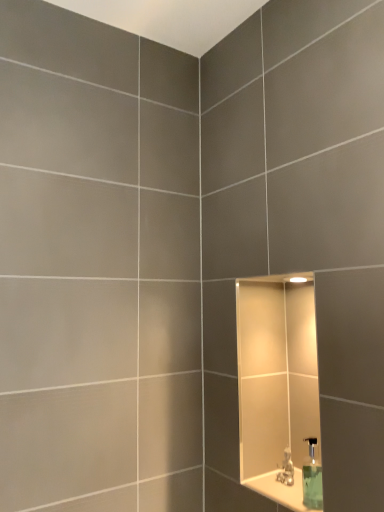
Question: From a real-world perspective, is green translucent soap dispenser at lower right positioned above or below satin nickel faucet at lower right?

Choices:
 (A) below
 (B) above

Answer: (B)

Question: Based on their sizes in the image, would you say green translucent soap dispenser at lower right is bigger or smaller than satin nickel faucet at lower right?

Choices:
 (A) small
 (B) big

Answer: (B)

Question: Which object is positioned farthest from the green translucent soap dispenser at lower right?

Choices:
 (A) satin nickel faucet at lower right
 (B) white glossy ledge at lower right

Answer: (A)

Question: Which object is the closest to the white glossy ledge at lower right?

Choices:
 (A) green translucent soap dispenser at lower right
 (B) satin nickel faucet at lower right

Answer: (B)